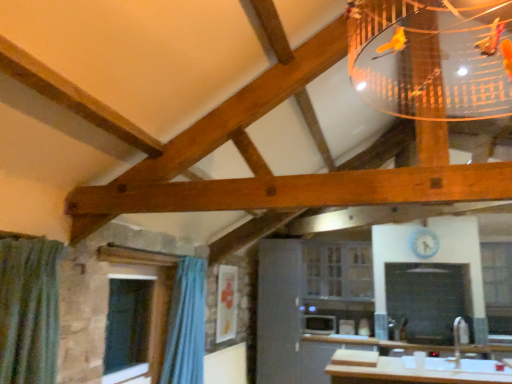
Question: Considering their positions, is clear glass cabinet at center, which appears as the 2th window when viewed from the left, located in front of or behind clear glass window at center, acting as the 2th window starting from the front?

Choices:
 (A) behind
 (B) front

Answer: (A)

Question: Which is correct: clear glass cabinet at center, which appears as the 2th window when viewed from the left, is inside clear glass window at center, the 2th window when ordered from back to front, or outside of it?

Choices:
 (A) outside
 (B) inside

Answer: (A)

Question: Which is nearer to the clear glass window at center, acting as the 2th window starting from the front?

Choices:
 (A) clear glass window at lower left, the third window viewed from the back
 (B) white glossy microwave at center
 (C) blue fabric curtain at lower left
 (D) clear glass cabinet at center, acting as the 2th window starting from the right

Answer: (D)

Question: Which of these objects is positioned closest to the clear glass cabinet at center, acting as the 2th window starting from the right?

Choices:
 (A) clear glass window at lower left, the 3th window in the right-to-left sequence
 (B) white glossy microwave at center
 (C) clear glass window at center, acting as the 2th window starting from the front
 (D) blue fabric curtain at lower left

Answer: (B)